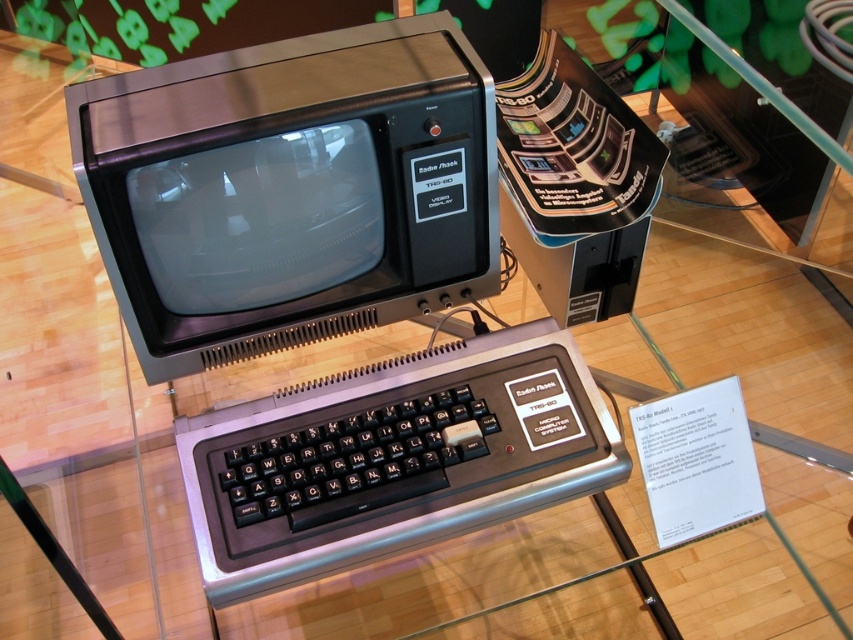
Who is positioned more to the right, matte black monitor at center or black plastic keyboard at center?

From the viewer's perspective, black plastic keyboard at center appears more on the right side.

Consider the image. Between matte black monitor at center and black plastic keyboard at center, which one is positioned lower?

black plastic keyboard at center is lower down.

Image resolution: width=853 pixels, height=640 pixels. Identify the location of matte black monitor at center. (289, 189).